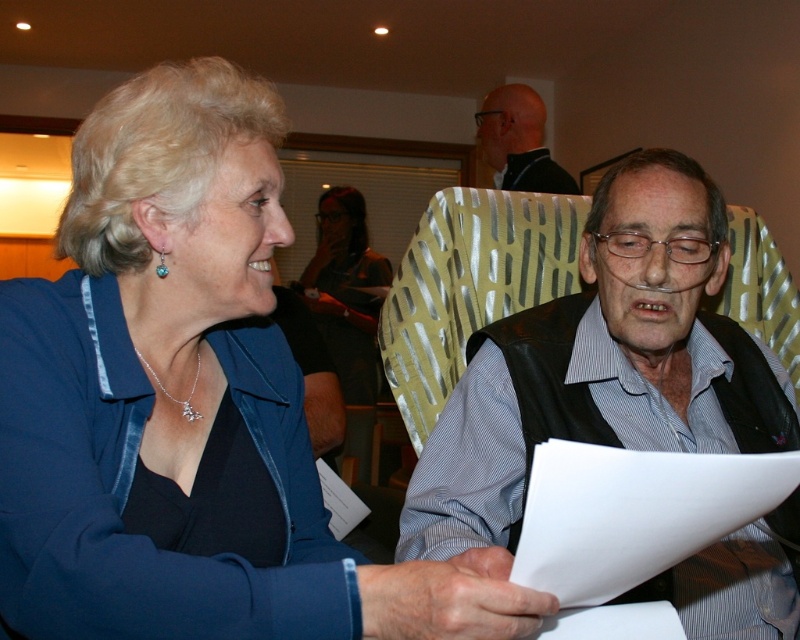
You are taking a photo of the scene and want to focus on both the point at (701, 404) and the point at (352, 225). Which point should you adjust your focus to first to ensure both are in sharp view?

You should focus on point (352, 225) first because it is farther from the camera compared to point (701, 404). By focusing on the farther point, the depth of field will naturally include the closer point as well.

You are at a social event and notice two people sitting together. You see a matte black vest at center and a matte black jacket at center. Which one is positioned to the right?

The matte black vest at center is positioned to the right of the matte black jacket at center.